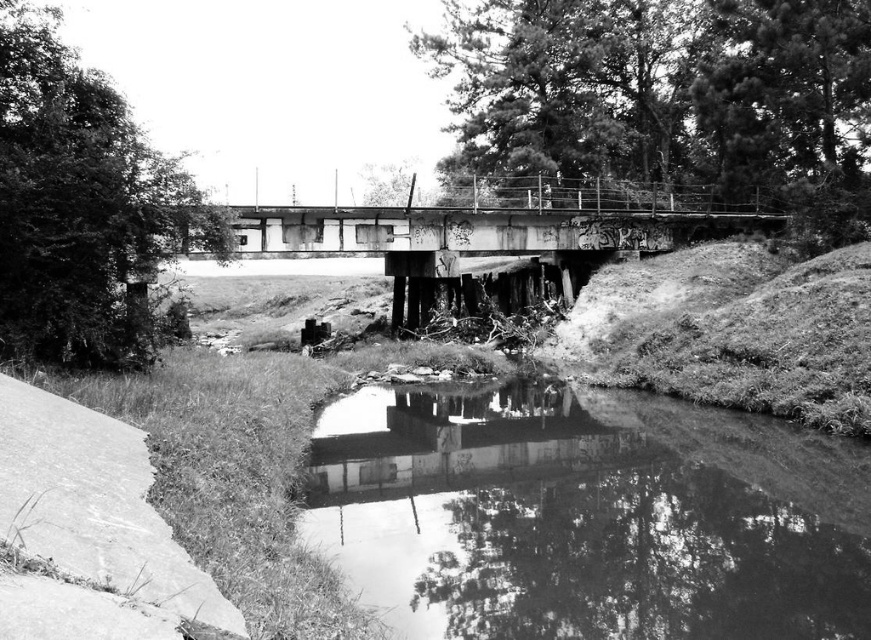
Question: Which point is closer to the camera?

Choices:
 (A) smooth concrete water at lower center
 (B) rusty metal bridge at center

Answer: (A)

Question: Which object appears closest to the camera in this image?

Choices:
 (A) rusty metal bridge at center
 (B) smooth concrete water at lower center

Answer: (B)

Question: From the image, what is the correct spatial relationship of smooth concrete water at lower center in relation to rusty metal bridge at center?

Choices:
 (A) right
 (B) left

Answer: (A)

Question: Which point appears closest to the camera in this image?

Choices:
 (A) (525, 522)
 (B) (737, 220)

Answer: (A)

Question: Can you confirm if smooth concrete water at lower center is smaller than rusty metal bridge at center?

Choices:
 (A) yes
 (B) no

Answer: (A)

Question: Is smooth concrete water at lower center positioned at the back of rusty metal bridge at center?

Choices:
 (A) yes
 (B) no

Answer: (B)